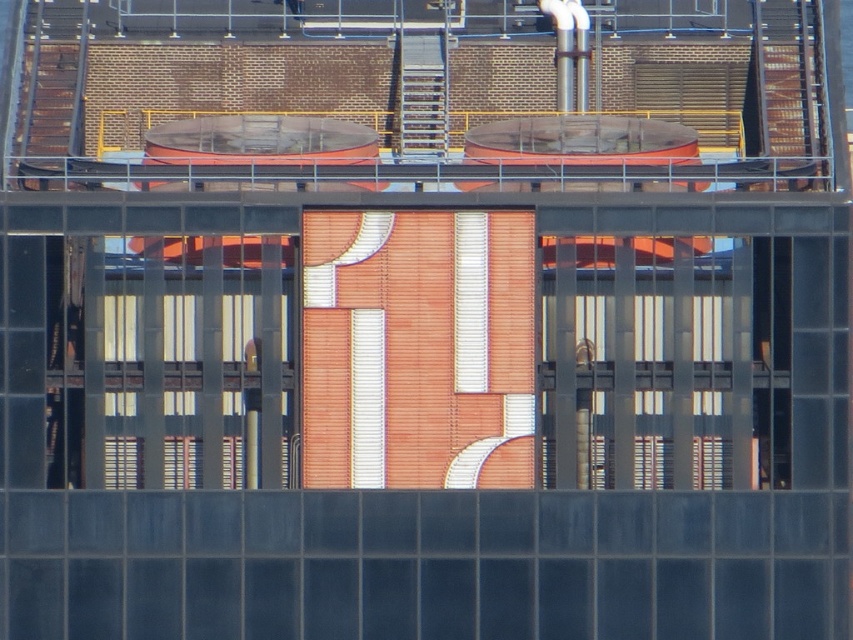
Can you confirm if transparent glass window at center is shorter than translucent glass window at center?

Indeed, transparent glass window at center has a lesser height compared to translucent glass window at center.

Who is higher up, transparent glass window at center or translucent glass window at center?

translucent glass window at center

Where is `transparent glass window at center`? The width and height of the screenshot is (853, 640). transparent glass window at center is located at coordinates (663, 362).

At what (x,y) coordinates should I click in order to perform the action: click on transparent glass window at center. Please return your answer as a coordinate pair (x, y). Looking at the image, I should click on (663, 362).